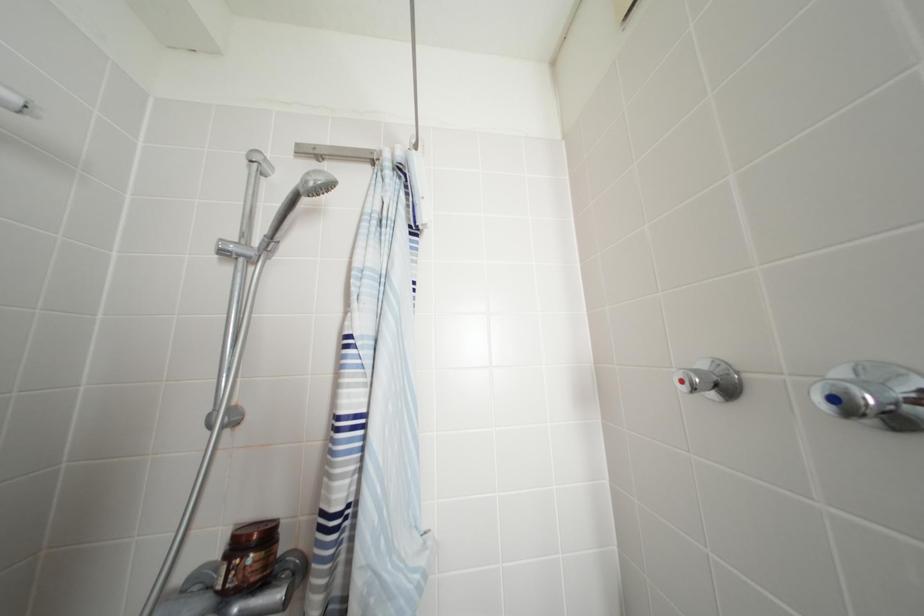
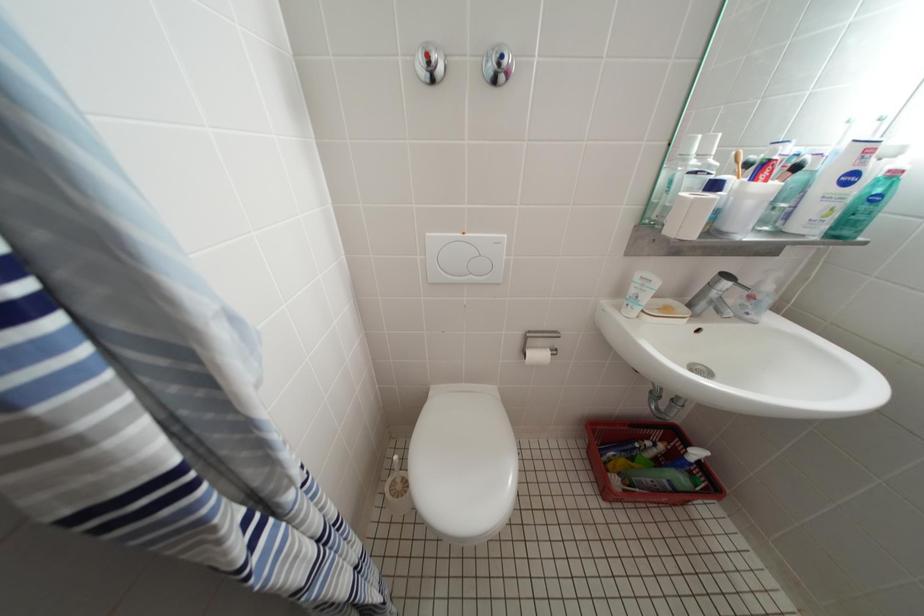
How did the camera likely rotate?

The camera's rotation is toward right-down.